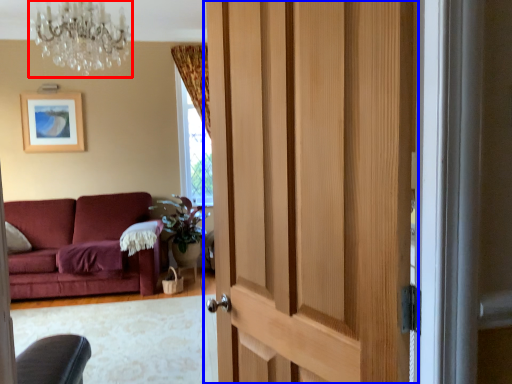
Question: Which of the following is the closest to the observer, chandelier (highlighted by a red box) or door (highlighted by a blue box)?

Choices:
 (A) chandelier
 (B) door

Answer: (B)